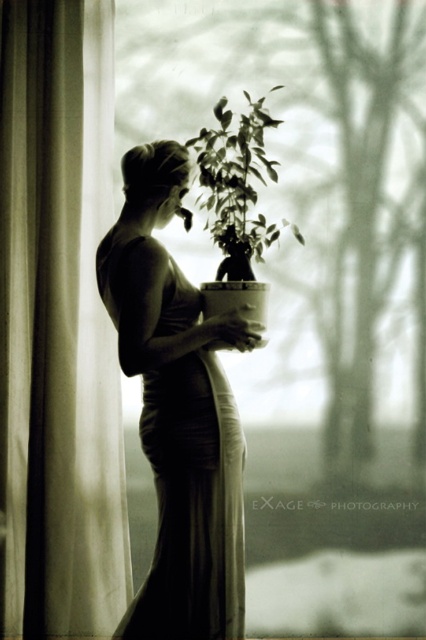
Question: Based on their relative distances, which object is farther from the matte white dress at center?

Choices:
 (A) white sheer curtain at left
 (B) green matte plant at center

Answer: (A)

Question: Does white sheer curtain at left have a lesser width compared to matte white dress at center?

Choices:
 (A) yes
 (B) no

Answer: (A)

Question: Where is matte white dress at center located in relation to green matte plant at center in the image?

Choices:
 (A) below
 (B) above

Answer: (A)

Question: Which of the following is the farthest from the observer?

Choices:
 (A) matte white dress at center
 (B) green matte plant at center
 (C) white sheer curtain at left

Answer: (C)

Question: Is matte white dress at center to the right of green matte plant at center from the viewer's perspective?

Choices:
 (A) no
 (B) yes

Answer: (A)

Question: Which point is farther from the camera taking this photo?

Choices:
 (A) (46, 579)
 (B) (226, 132)
 (C) (169, 317)

Answer: (A)